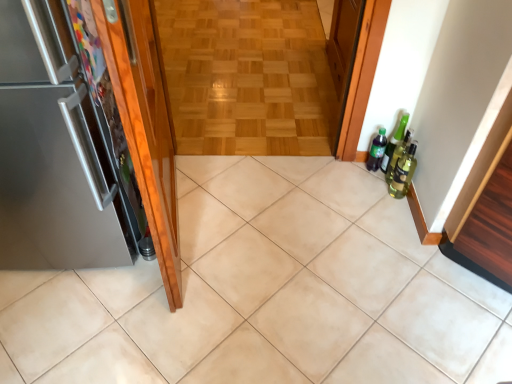
I want to click on free point above beige ceramic tile at center (from a real-world perspective), so click(x=267, y=273).